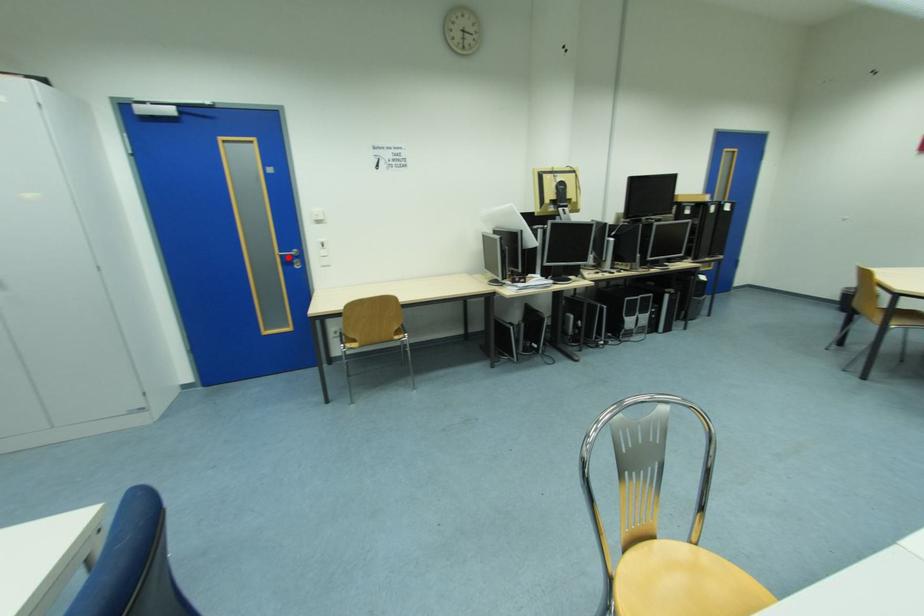
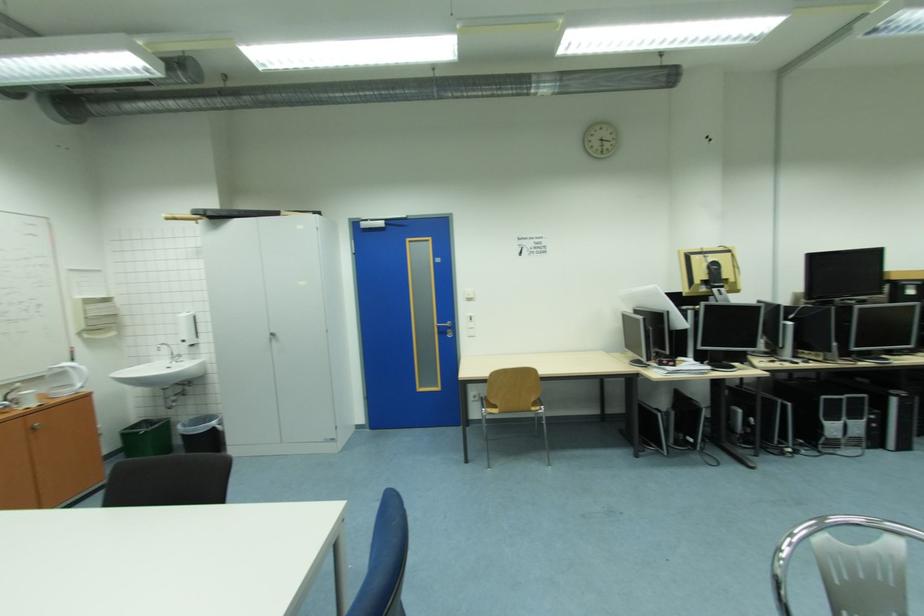
In the second image, find the point that corresponds to the highlighted location in the first image.

(445, 328)